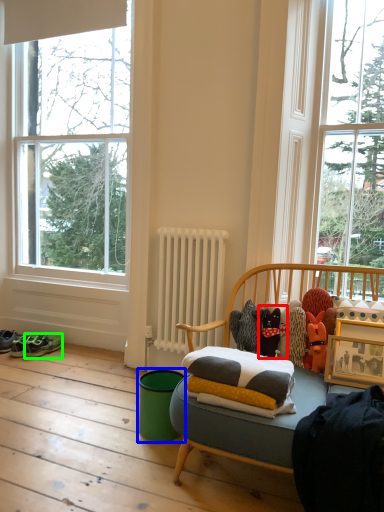
Question: Based on their relative distances, which object is nearer to toy (highlighted by a red box)? Choose from teal (highlighted by a blue box) and running shoe (highlighted by a green box).

Choices:
 (A) teal
 (B) running shoe

Answer: (A)